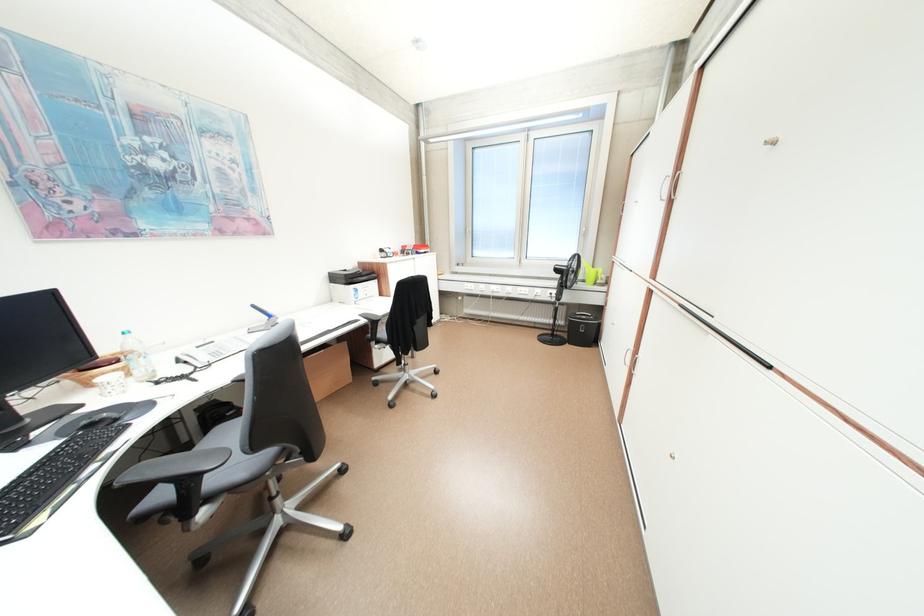
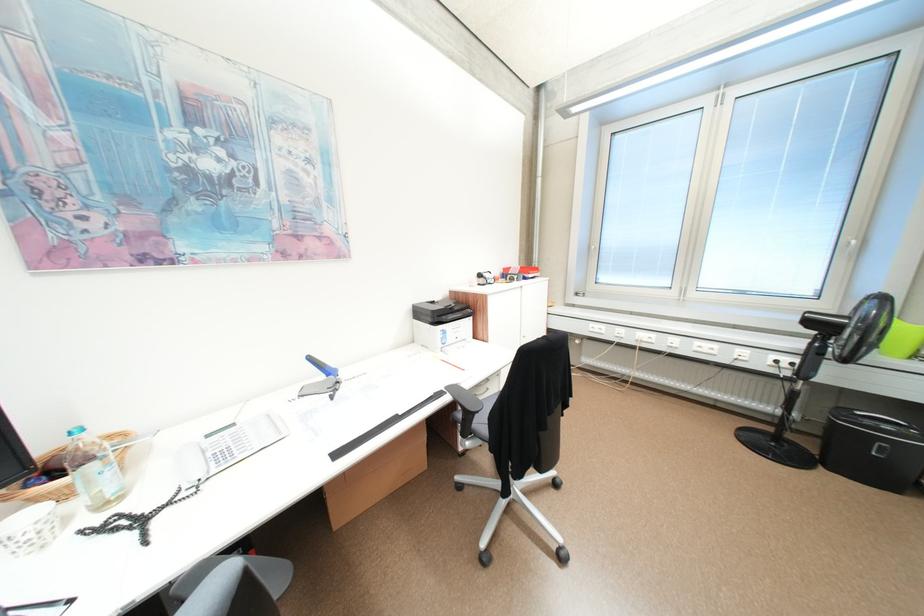
Find the pixel in the second image that matches point 263,307 in the first image.

(320, 359)